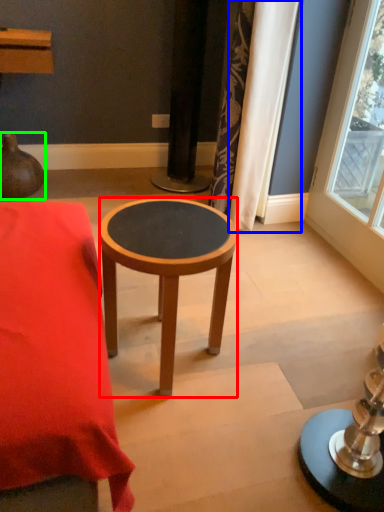
Question: Considering the real-world distances, which object is farthest from stool (highlighted by a red box)? curtain (highlighted by a blue box) or vase (highlighted by a green box)?

Choices:
 (A) curtain
 (B) vase

Answer: (B)